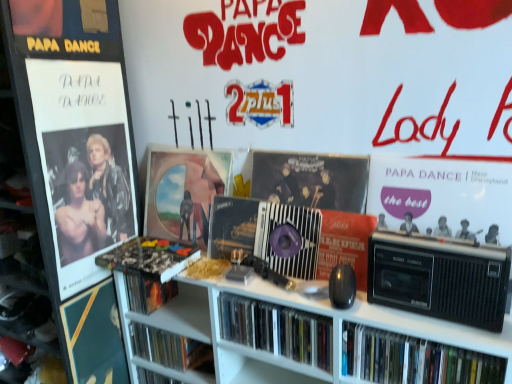
Question: From a real-world perspective, is metallic silver cassette at center, which appears as the 2th cassette when viewed from the front, above or below matte black book at center, placed as the fourth book when sorted from right to left?

Choices:
 (A) below
 (B) above

Answer: (B)

Question: Considering the positions of metallic silver cassette at center, the 1th cassette positioned from the back, and matte black book at center, placed as the fourth book when sorted from right to left, in the image, is metallic silver cassette at center, the 1th cassette positioned from the back, taller or shorter than matte black book at center, placed as the fourth book when sorted from right to left,?

Choices:
 (A) short
 (B) tall

Answer: (B)

Question: Which of these objects is positioned farthest from the matte black cd case at center, the third book in the left-to-right sequence?

Choices:
 (A) matte black book at center, placed as the fourth book when sorted from right to left
 (B) black plastic radio at right, which is the 1th book from right to left
 (C) metallic silver cassette at center, the 1th cassette positioned from the back
 (D) black plastic cassette at right, the second cassette when ordered from back to front
 (E) matte black record player at right

Answer: (A)

Question: Estimate the real-world distances between objects in this image. Which object is closer to the matte black book at center, acting as the first book starting from the left?

Choices:
 (A) white plastic bookcase at center
 (B) matte black cd case at center, the third book in the left-to-right sequence
 (C) camouflage-patterned book at center, placed as the third book when sorted from right to left
 (D) metallic silver cassette at center, the 1th cassette viewed from the left
 (E) matte vinyl record at center

Answer: (C)